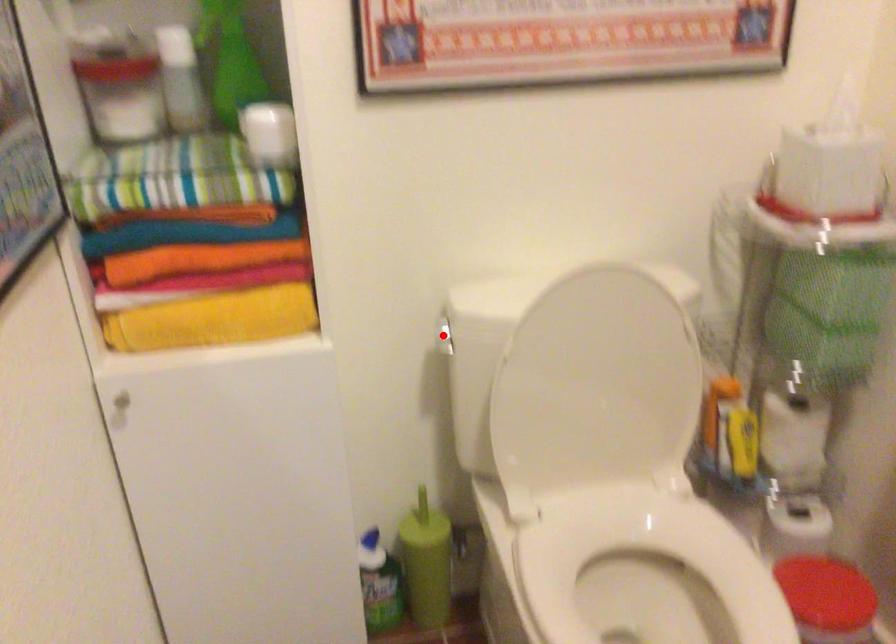
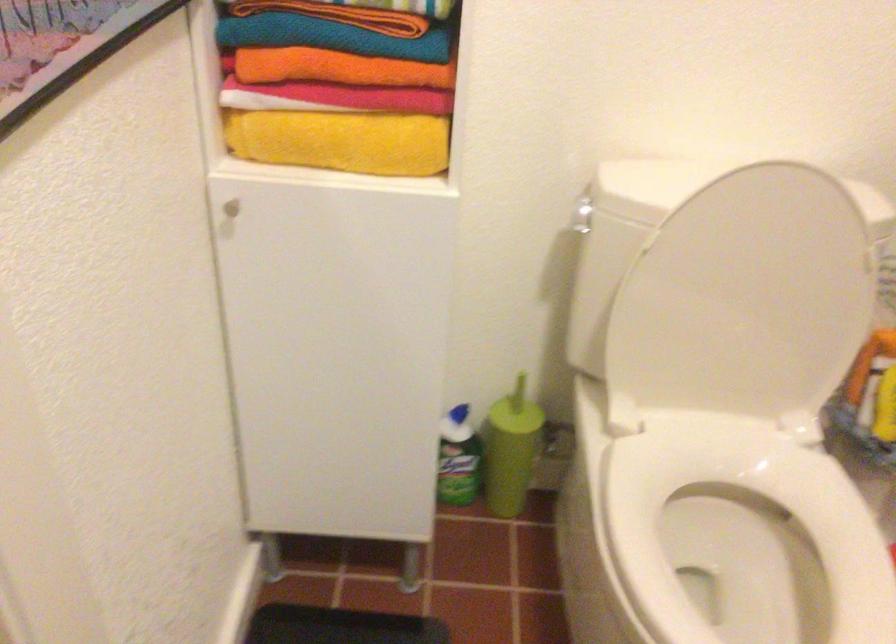
Find the pixel in the second image that matches the highlighted location in the first image.

(581, 214)